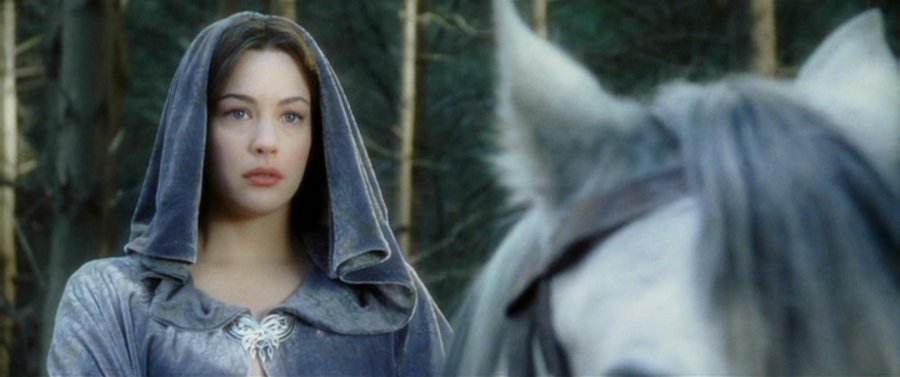
You are a GUI agent. You are given a task and a screenshot of the screen. Output one action in this format:
    pyautogui.click(x=<x>, y=<y>)
    Task: Click on the hood
    
    Given the screenshot: What is the action you would take?
    [165, 193], [181, 139], [184, 101], [335, 189], [336, 145]